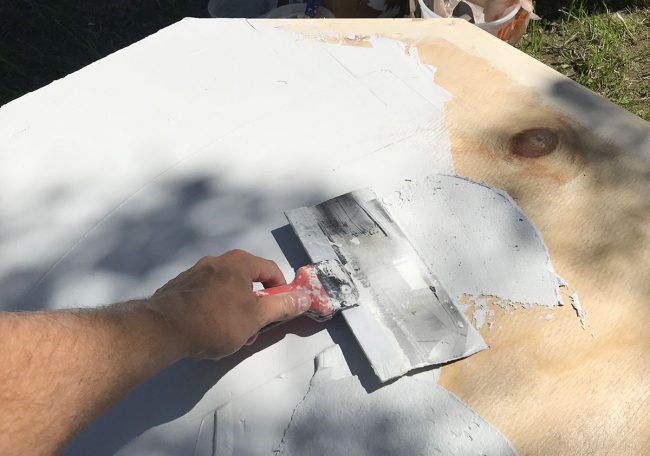
The image size is (650, 456). I want to click on bucket, so click(x=491, y=13).